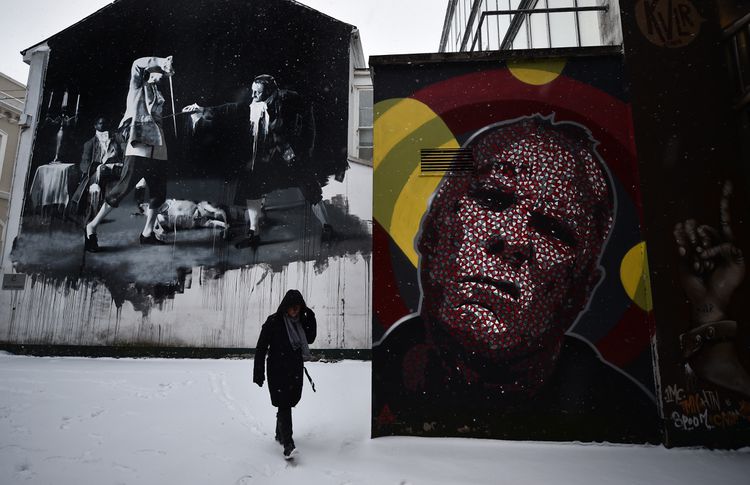
This screenshot has width=750, height=485. In order to click on candles on the painting in this screenshot , I will do `click(66, 100)`, `click(78, 109)`, `click(50, 97)`.